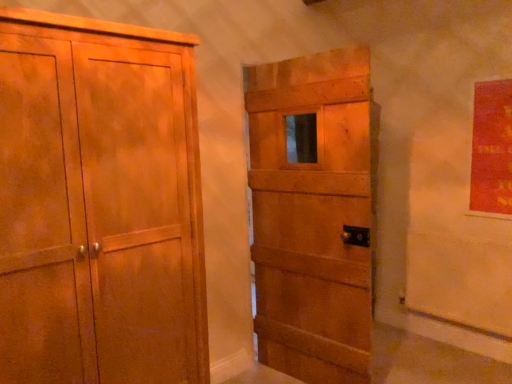
Question: Considering the relative positions of matte wood cupboard at left and matte wooden door at center in the image provided, is matte wood cupboard at left to the left or to the right of matte wooden door at center?

Choices:
 (A) left
 (B) right

Answer: (A)

Question: Relative to matte wooden door at center, is matte wood cupboard at left in front or behind?

Choices:
 (A) front
 (B) behind

Answer: (A)

Question: Considering the positions of matte wood cupboard at left and matte wooden door at center in the image, is matte wood cupboard at left wider or thinner than matte wooden door at center?

Choices:
 (A) thin
 (B) wide

Answer: (B)

Question: From a real-world perspective, is matte wooden door at center physically located above or below matte wood cupboard at left?

Choices:
 (A) below
 (B) above

Answer: (A)

Question: Looking at the image, does matte wooden door at center seem bigger or smaller compared to matte wood cupboard at left?

Choices:
 (A) big
 (B) small

Answer: (B)

Question: Considering the positions of matte wooden door at center and matte wood cupboard at left in the image, is matte wooden door at center taller or shorter than matte wood cupboard at left?

Choices:
 (A) tall
 (B) short

Answer: (A)

Question: From the image's perspective, is matte wooden door at center positioned above or below matte wood cupboard at left?

Choices:
 (A) above
 (B) below

Answer: (A)